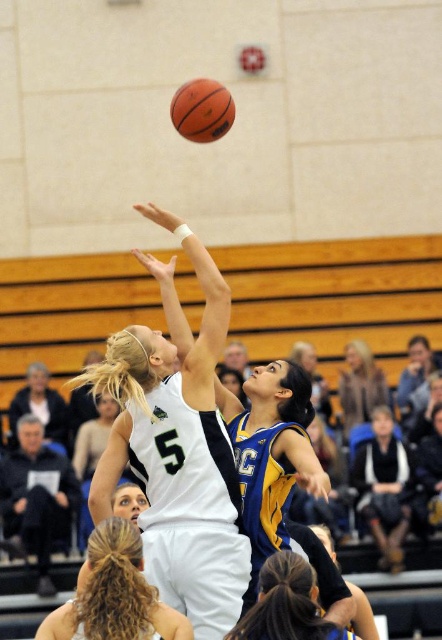
You are a spectator standing at the baseline of the gymnasium. You want to throw a small paper airplane from your position to hit the rubber textured basketball at center and then have it land near the brown leather jacket at upper right. Is the distance between the basketball and the jacket sufficient for the paper airplane to travel from the basketball to the jacket?

The distance between the rubber textured basketball at center and the brown leather jacket at upper right is 30.08 meters. However, typical small paper airplanes have a limited flight range of around 10 to 20 meters. Therefore, the paper airplane would not be able to travel the 30.08 meters from the basketball to the jacket.